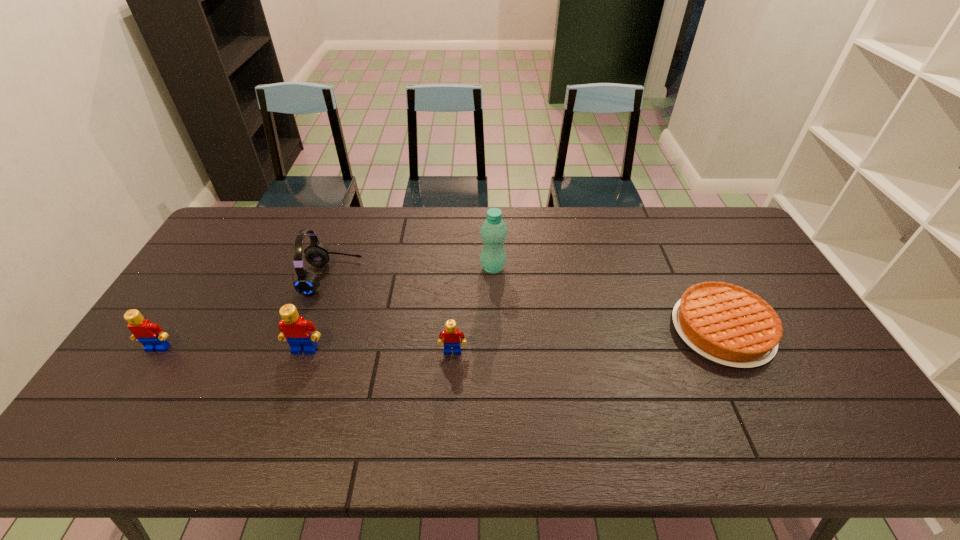
Where is `free space located 0.060m on the front-facing side of the leftmost object`? free space located 0.060m on the front-facing side of the leftmost object is located at coordinates (143, 372).

Identify the location of vacant region located 0.080m on the front-facing side of the second Lego from right to left. (294, 381).

Image resolution: width=960 pixels, height=540 pixels. I want to click on vacant space located 0.170m on the front-facing side of the second shortest object, so [449, 413].

This screenshot has height=540, width=960. Identify the location of free space located on the left of the shortest object. (604, 330).

Where is `vacant space located 0.390m on the left of the tallest object`? vacant space located 0.390m on the left of the tallest object is located at coordinates (362, 267).

The image size is (960, 540). Identify the location of free space located on the ear cushions of the headset. (464, 277).

At what (x,y) coordinates should I click in order to perform the action: click on object at the left edge. Please return your answer as a coordinate pair (x, y). The image size is (960, 540). Looking at the image, I should click on (151, 335).

Locate an element on the screen. object that is at the right edge is located at coordinates (727, 324).

In the image, there is a desktop. Where is `vacant space at the far edge`? This screenshot has width=960, height=540. vacant space at the far edge is located at coordinates (x=275, y=219).

Locate an element on the screen. vacant space at the near edge is located at coordinates (293, 388).